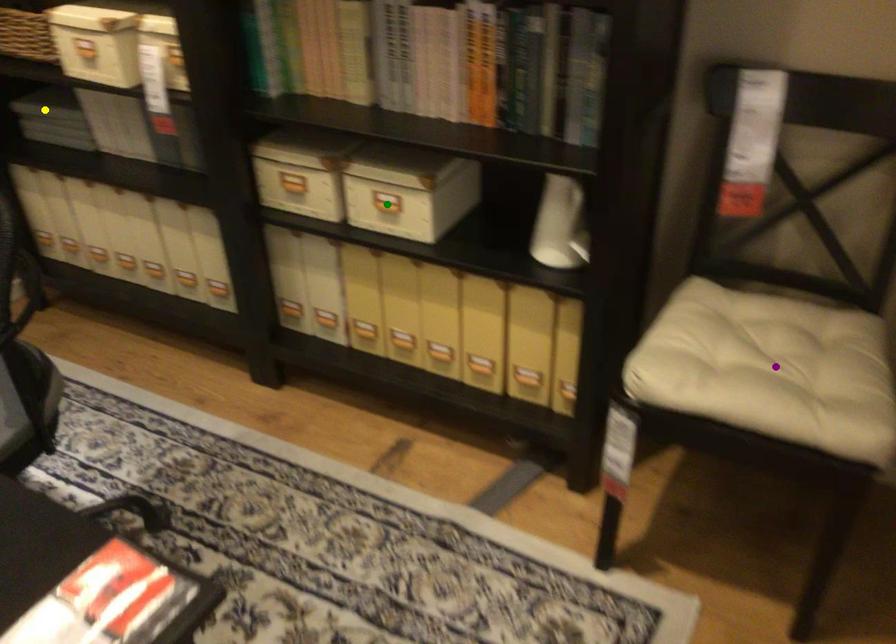
Order these from nearest to farthest:
yellow point
purple point
green point

yellow point → green point → purple point